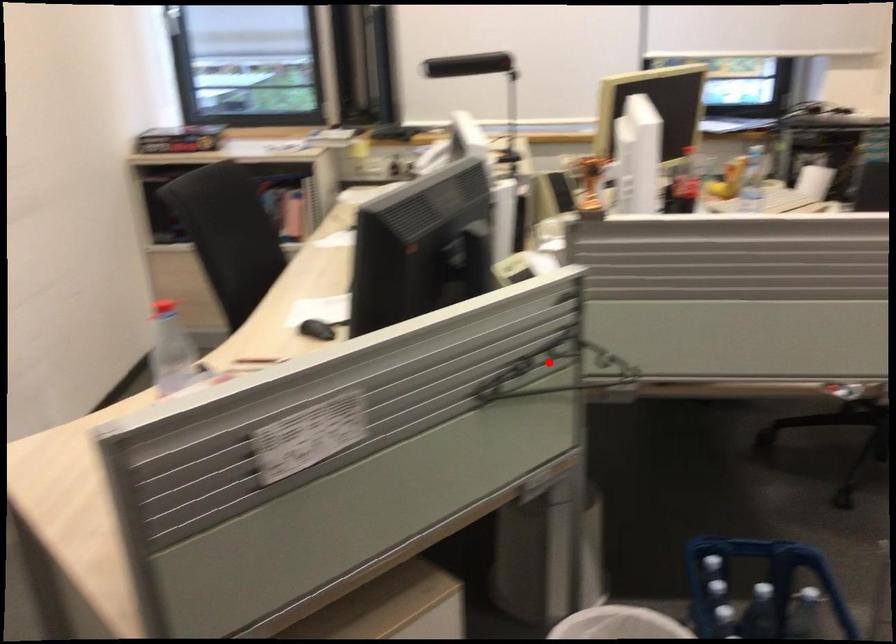
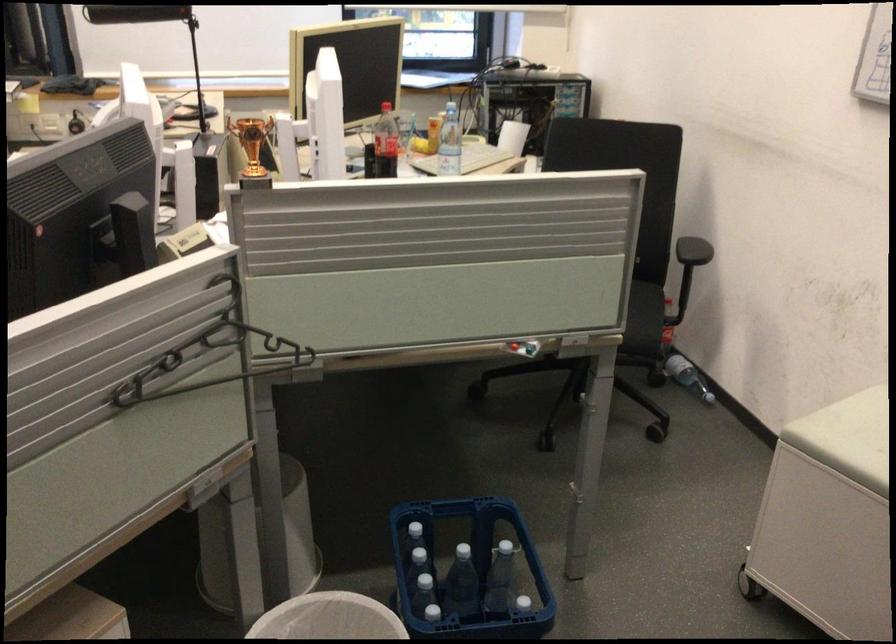
In the second image, find the point that corresponds to the highlighted location in the first image.

(209, 355)